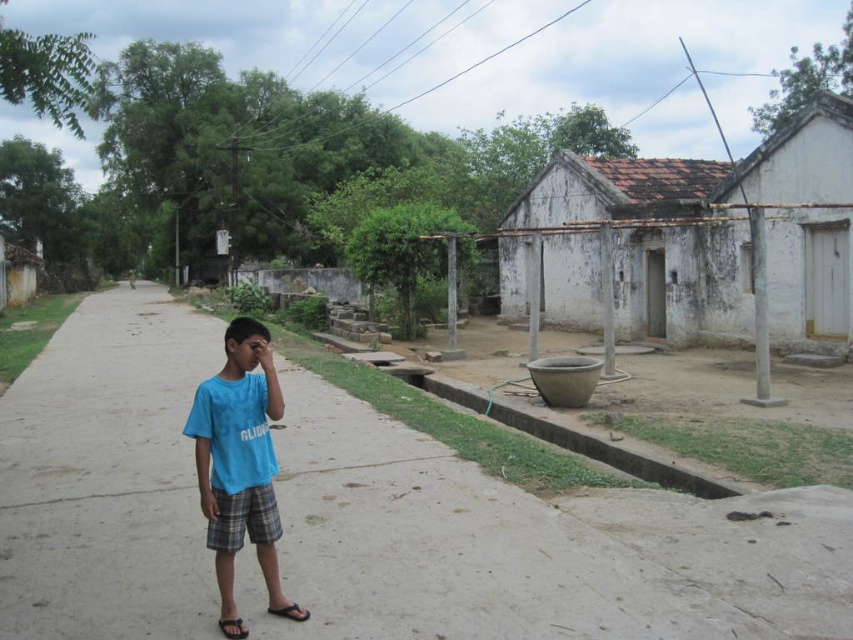
Question: Is gray concrete pavement at center to the left of white weathered hut at right from the viewer's perspective?

Choices:
 (A) yes
 (B) no

Answer: (A)

Question: Which object is the farthest from the white weathered hut at right?

Choices:
 (A) gray concrete pavement at center
 (B) blue t-shirt at center

Answer: (B)

Question: Which point appears closest to the camera in this image?

Choices:
 (A) (770, 630)
 (B) (552, 168)
 (C) (263, 326)

Answer: (A)

Question: Is gray concrete pavement at center thinner than white weathered hut at right?

Choices:
 (A) no
 (B) yes

Answer: (A)

Question: Is white weathered hut at right bigger than blue t-shirt at center?

Choices:
 (A) no
 (B) yes

Answer: (B)

Question: Which of the following is the farthest from the observer?

Choices:
 (A) gray concrete pavement at center
 (B) white weathered hut at right

Answer: (B)